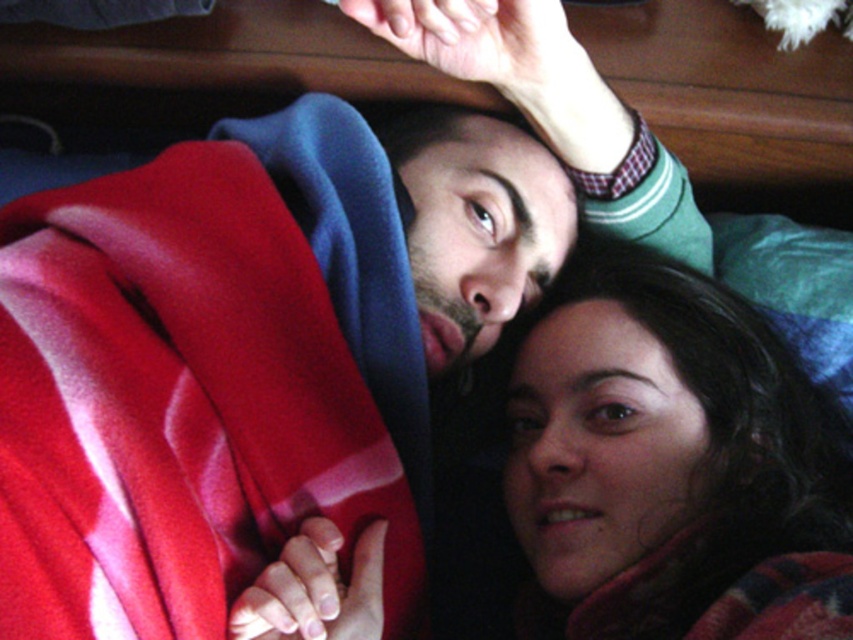
Is velvety red blanket at upper left thinner than smooth skin face at center?

No.

Can you confirm if velvety red blanket at upper left is taller than smooth skin face at center?

Yes, velvety red blanket at upper left is taller than smooth skin face at center.

This screenshot has width=853, height=640. What do you see at coordinates (177, 404) in the screenshot?
I see `velvety red blanket at upper left` at bounding box center [177, 404].

Locate an element on the screen. velvety red blanket at upper left is located at coordinates (177, 404).